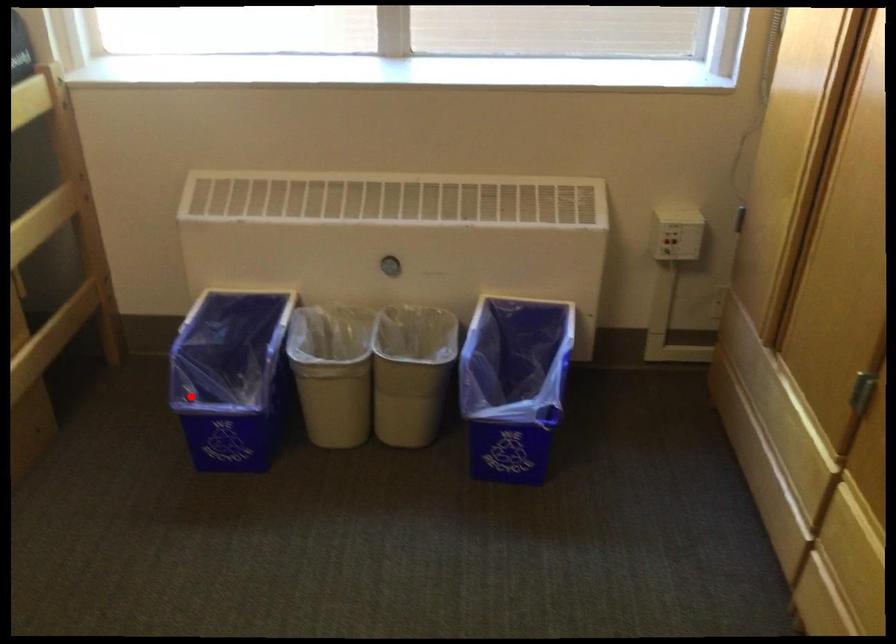
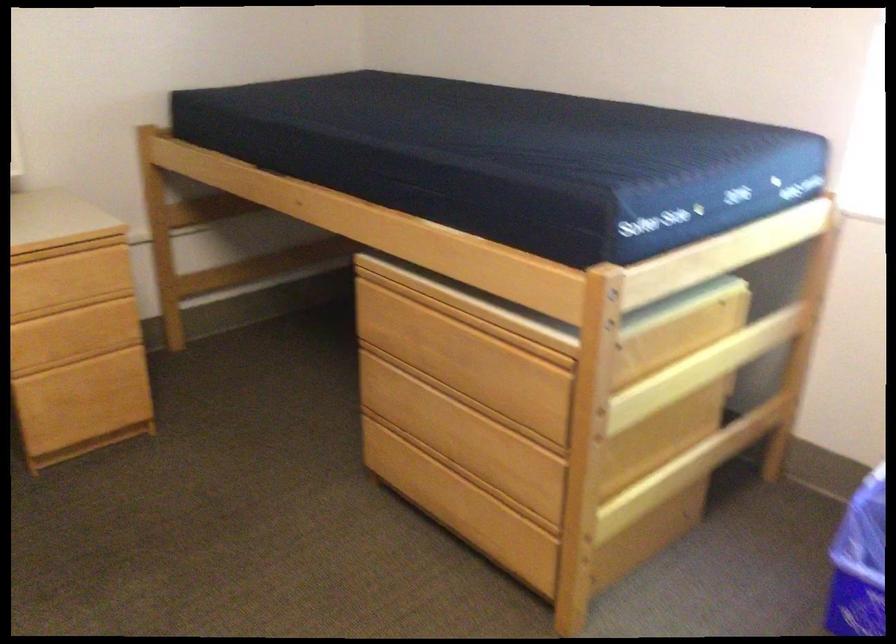
Locate, in the second image, the point that corresponds to the highlighted location in the first image.

(858, 563)